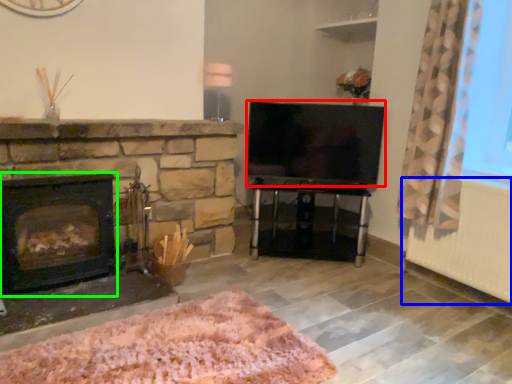
Question: Which object is the farthest from television (highlighted by a red box)? Choose among these: radiator (highlighted by a blue box) or wood burning stove (highlighted by a green box).

Choices:
 (A) radiator
 (B) wood burning stove

Answer: (B)